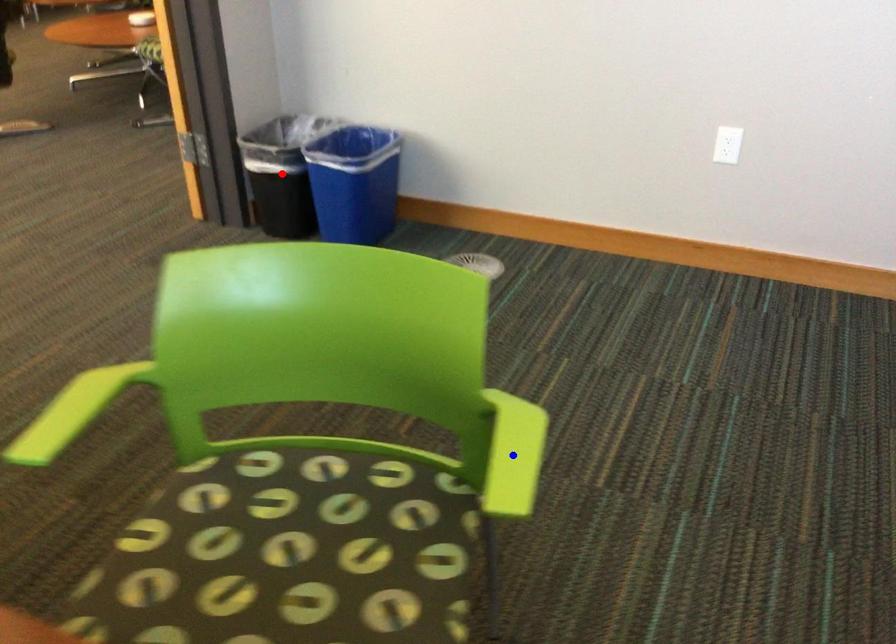
Question: Two points are marked on the image. Which point is closer to the camera?

Choices:
 (A) Blue point is closer.
 (B) Red point is closer.

Answer: (A)